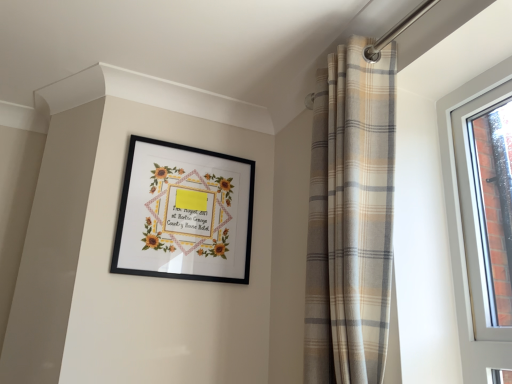
Question: Does black matte picture frame at upper center have a lesser height compared to beige plaid curtain at upper right?

Choices:
 (A) yes
 (B) no

Answer: (A)

Question: Could you tell me if black matte picture frame at upper center is facing beige plaid curtain at upper right?

Choices:
 (A) no
 (B) yes

Answer: (B)

Question: Is beige plaid curtain at upper right at the back of black matte picture frame at upper center?

Choices:
 (A) no
 (B) yes

Answer: (A)

Question: From a real-world perspective, is black matte picture frame at upper center positioned under beige plaid curtain at upper right based on gravity?

Choices:
 (A) yes
 (B) no

Answer: (B)

Question: Considering the relative positions of black matte picture frame at upper center and beige plaid curtain at upper right in the image provided, is black matte picture frame at upper center to the left of beige plaid curtain at upper right from the viewer's perspective?

Choices:
 (A) yes
 (B) no

Answer: (A)

Question: From a real-world perspective, is black matte picture frame at upper center located higher than beige plaid curtain at upper right?

Choices:
 (A) no
 (B) yes

Answer: (B)

Question: Could you tell me if beige plaid curtain at upper right is turned towards black matte picture frame at upper center?

Choices:
 (A) no
 (B) yes

Answer: (A)

Question: Could black matte picture frame at upper center be considered to be inside beige plaid curtain at upper right?

Choices:
 (A) yes
 (B) no

Answer: (B)

Question: Is beige plaid curtain at upper right with black matte picture frame at upper center?

Choices:
 (A) yes
 (B) no

Answer: (B)

Question: Considering the relative sizes of beige plaid curtain at upper right and black matte picture frame at upper center in the image provided, is beige plaid curtain at upper right taller than black matte picture frame at upper center?

Choices:
 (A) no
 (B) yes

Answer: (B)

Question: Is beige plaid curtain at upper right at the left side of black matte picture frame at upper center?

Choices:
 (A) yes
 (B) no

Answer: (B)

Question: From a real-world perspective, is beige plaid curtain at upper right located beneath black matte picture frame at upper center?

Choices:
 (A) yes
 (B) no

Answer: (A)

Question: From the image's perspective, relative to black matte picture frame at upper center, is beige plaid curtain at upper right above or below?

Choices:
 (A) below
 (B) above

Answer: (B)